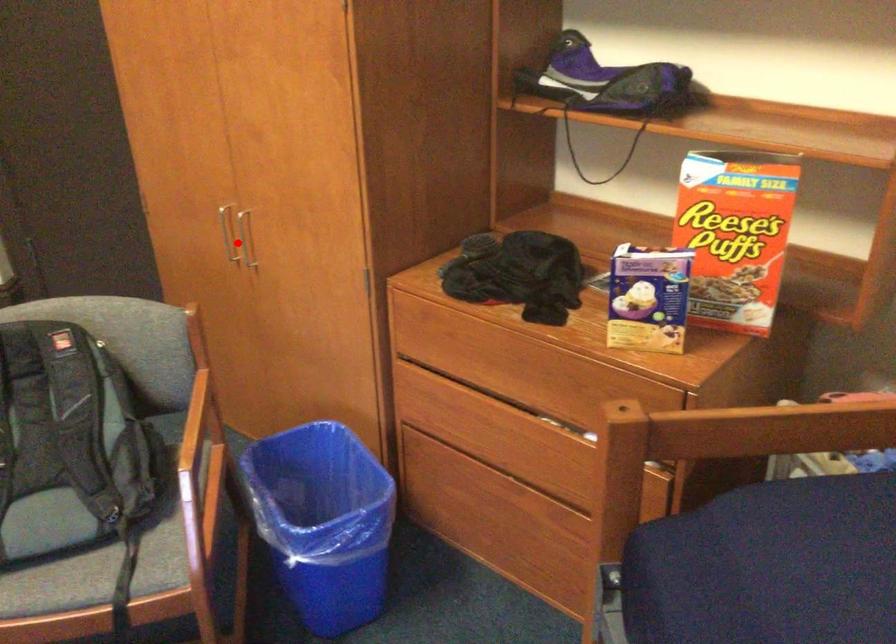
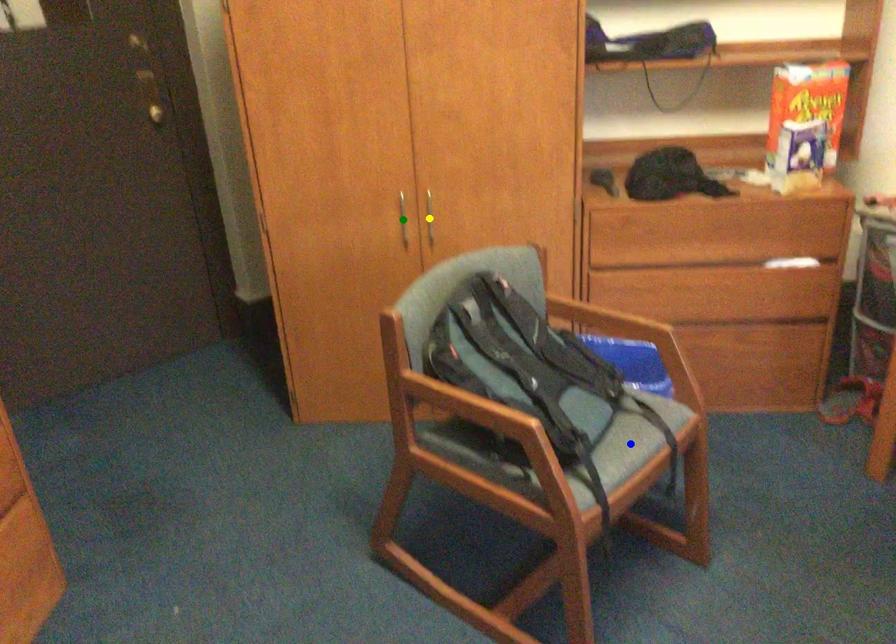
Question: I am providing you with two images of the same scene from different viewpoints. A red point is marked on the first image. You are given multiple points on the second image. Which point in image 2 represents the same 3d spot as the red point in image 1?

Choices:
 (A) yellow point
 (B) green point
 (C) blue point

Answer: (B)